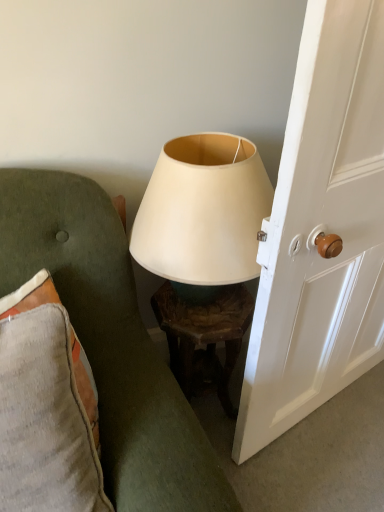
Question: Looking at the image, does wooden textured table at center seem bigger or smaller compared to textured gray cushion at left?

Choices:
 (A) small
 (B) big

Answer: (A)

Question: From the image's perspective, is wooden textured table at center positioned above or below textured gray cushion at left?

Choices:
 (A) below
 (B) above

Answer: (A)

Question: Estimate the real-world distances between objects in this image. Which object is closer to the white wood door at right?

Choices:
 (A) wooden textured table at center
 (B) textured gray cushion at left
 (C) textured gray pillow at left
 (D) matte white lampshade at center

Answer: (D)

Question: Based on their relative distances, which object is farther from the white wood door at right?

Choices:
 (A) textured gray cushion at left
 (B) wooden textured table at center
 (C) textured gray pillow at left
 (D) matte white lampshade at center

Answer: (C)